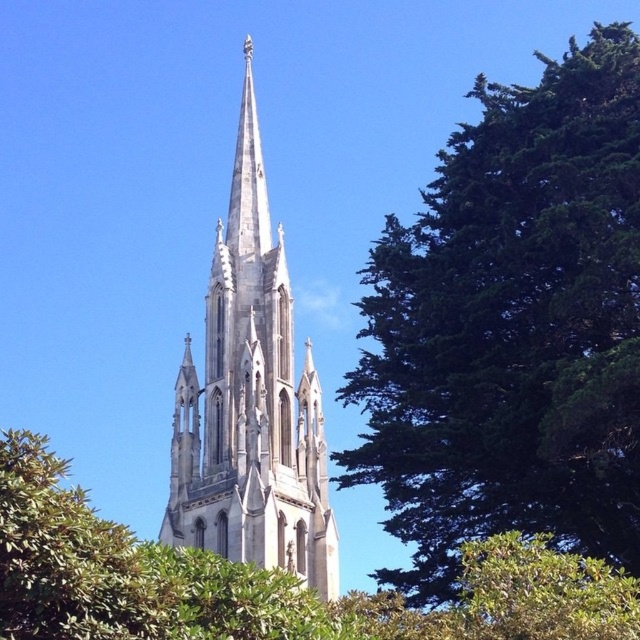
You are an architect analyzing the Gothic church design. You notice the green leafy tree at upper right and the white stone spire at center. Which object is located higher in the image?

The white stone spire at center is higher in the image than the green leafy tree at upper right because the tree is positioned under it.